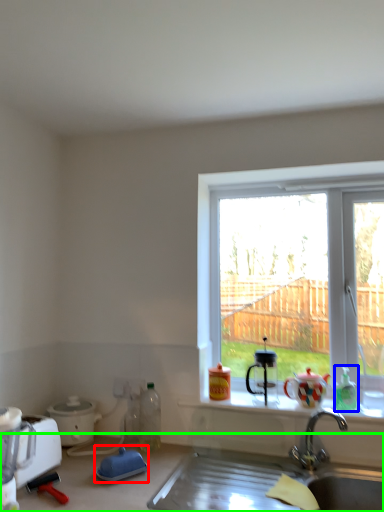
Question: Based on their relative distances, which object is nearer to appliance (highlighted by a red box)? Choose from bottle (highlighted by a blue box) and countertop (highlighted by a green box).

Choices:
 (A) bottle
 (B) countertop

Answer: (B)